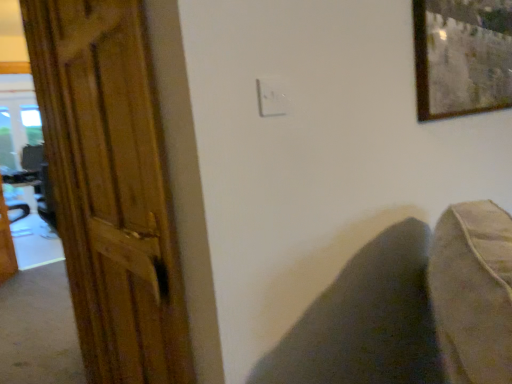
Question: Could you tell me if wooden table at left is turned towards dark fabric swivel chair at lower right?

Choices:
 (A) no
 (B) yes

Answer: (B)

Question: Can you confirm if wooden table at left is positioned to the left of dark fabric swivel chair at lower right?

Choices:
 (A) no
 (B) yes

Answer: (B)

Question: From a real-world perspective, is wooden table at left physically below dark fabric swivel chair at lower right?

Choices:
 (A) yes
 (B) no

Answer: (B)

Question: Is wooden table at left not close to dark fabric swivel chair at lower right?

Choices:
 (A) yes
 (B) no

Answer: (A)

Question: Considering the relative sizes of wooden table at left and dark fabric swivel chair at lower right in the image provided, is wooden table at left wider than dark fabric swivel chair at lower right?

Choices:
 (A) yes
 (B) no

Answer: (B)

Question: Looking at the image, does wooden table at left seem bigger or smaller compared to dark fabric swivel chair at lower right?

Choices:
 (A) big
 (B) small

Answer: (A)

Question: Is wooden table at left taller or shorter than dark fabric swivel chair at lower right?

Choices:
 (A) tall
 (B) short

Answer: (A)

Question: From a real-world perspective, is wooden table at left physically located above or below dark fabric swivel chair at lower right?

Choices:
 (A) above
 (B) below

Answer: (A)

Question: Is point (46, 188) positioned closer to the camera than point (428, 316)?

Choices:
 (A) farther
 (B) closer

Answer: (A)

Question: Is wooden door at left in front of or behind white plastic electric outlet at center in the image?

Choices:
 (A) behind
 (B) front

Answer: (B)

Question: From the image's perspective, relative to white plastic electric outlet at center, is wooden door at left above or below?

Choices:
 (A) above
 (B) below

Answer: (B)

Question: Is wooden door at left spatially inside white plastic electric outlet at center, or outside of it?

Choices:
 (A) outside
 (B) inside

Answer: (A)

Question: Is point (90, 49) closer or farther from the camera than point (272, 89)?

Choices:
 (A) farther
 (B) closer

Answer: (A)

Question: Is white plastic electric outlet at center spatially inside wooden table at left, or outside of it?

Choices:
 (A) outside
 (B) inside

Answer: (A)

Question: Considering their positions, is white plastic electric outlet at center located in front of or behind wooden table at left?

Choices:
 (A) front
 (B) behind

Answer: (A)